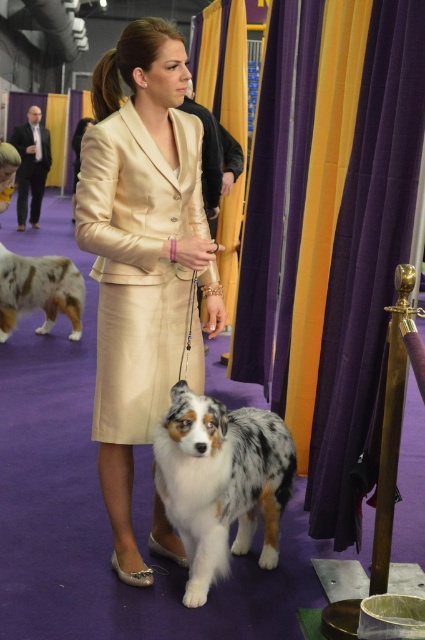
Is spotted fur dog at center to the left of white and brown fur at center from the viewer's perspective?

No, spotted fur dog at center is not to the left of white and brown fur at center.

Who is more distant from viewer, (229,566) or (79,314)?

The point (79,314) is behind.

Locate an element on the screen. Image resolution: width=425 pixels, height=640 pixels. spotted fur dog at center is located at coordinates (221, 481).

Is spotted fur dog at center thinner than matte black suit at left?

Yes.

Who is more forward, (201, 481) or (20, 176)?

Point (201, 481) is in front.

Identify the location of spotted fur dog at center. The height and width of the screenshot is (640, 425). (221, 481).

Which of these two, gold shiny suit at center or matte black suit at left, stands shorter?

matte black suit at left is shorter.

Who is taller, gold shiny suit at center or matte black suit at left?

gold shiny suit at center is taller.

What are the coordinates of `gold shiny suit at center` in the screenshot? It's located at (141, 253).